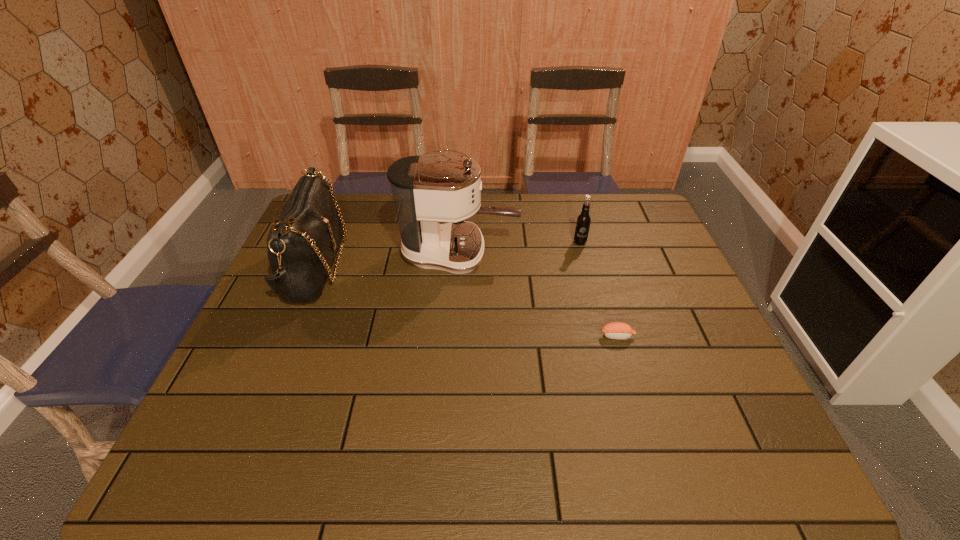
Locate an element on the screen. This screenshot has height=540, width=960. the third object from right to left is located at coordinates (427, 189).

At what (x,y) coordinates should I click in order to perform the action: click on coffee maker. Please return your answer as a coordinate pair (x, y). The width and height of the screenshot is (960, 540). Looking at the image, I should click on point(427,189).

Identify the location of handbag. The width and height of the screenshot is (960, 540). (302, 243).

I want to click on the leftmost object, so click(x=302, y=243).

At what (x,y) coordinates should I click in order to perform the action: click on the second shortest object. Please return your answer as a coordinate pair (x, y). Looking at the image, I should click on (583, 221).

This screenshot has height=540, width=960. What are the coordinates of `the shortest object` in the screenshot? It's located at (616, 330).

You are a GUI agent. You are given a task and a screenshot of the screen. Output one action in this format:
    pyautogui.click(x=<x>, y=<y>)
    Task: Click on the nearest object
    The height and width of the screenshot is (540, 960).
    Given the screenshot: What is the action you would take?
    pyautogui.click(x=616, y=330)

Locate an element on the screen. The width and height of the screenshot is (960, 540). free space located 0.240m on the front-facing side of the tallest object is located at coordinates (595, 253).

At what (x,y) coordinates should I click in order to perform the action: click on vacant space located 0.160m at the front of the third shortest object with chain and zipper. Please return your answer as a coordinate pair (x, y). The width and height of the screenshot is (960, 540). Looking at the image, I should click on (398, 267).

Image resolution: width=960 pixels, height=540 pixels. I want to click on free space located 0.160m on the label of the root beer, so click(x=590, y=281).